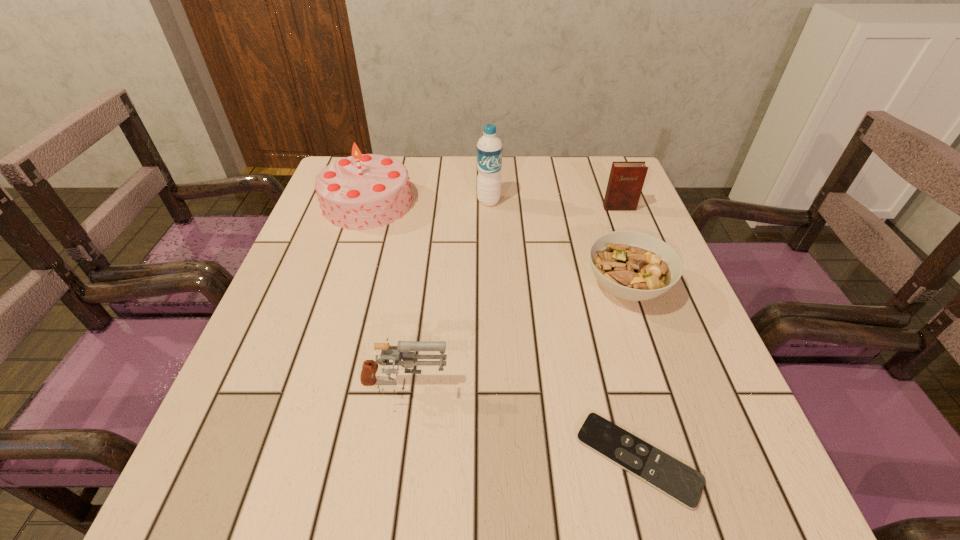
Locate an element on the screen. diary at the right edge is located at coordinates (626, 180).

Image resolution: width=960 pixels, height=540 pixels. Identify the location of stew at the right edge. (631, 265).

At what (x,y) coordinates should I click in order to perform the action: click on remote control present at the right edge. Please return your answer as a coordinate pair (x, y). Looking at the image, I should click on (685, 485).

Locate an element on the screen. object situated at the far left corner is located at coordinates (364, 191).

Where is `object that is positioned at the near right corner`? The width and height of the screenshot is (960, 540). object that is positioned at the near right corner is located at coordinates (685, 485).

Locate an element on the screen. The width and height of the screenshot is (960, 540). vacant space at the far edge of the desktop is located at coordinates (548, 188).

At what (x,y) coordinates should I click in order to perform the action: click on free space at the left edge. Please return your answer as a coordinate pair (x, y). The width and height of the screenshot is (960, 540). Looking at the image, I should click on (336, 240).

Where is `blank space at the right edge of the desktop`? This screenshot has height=540, width=960. blank space at the right edge of the desktop is located at coordinates (649, 312).

I want to click on blank region between the second tallest object and the water bottle, so click(x=428, y=202).

Identify the location of vacant point located between the second shortest object and the remote control. (632, 373).